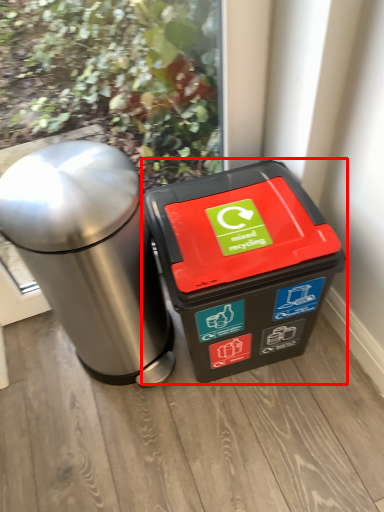
Question: Considering the relative positions of waste container (annotated by the red box) and waste container in the image provided, where is waste container (annotated by the red box) located with respect to the staircase?

Choices:
 (A) right
 (B) left

Answer: (A)